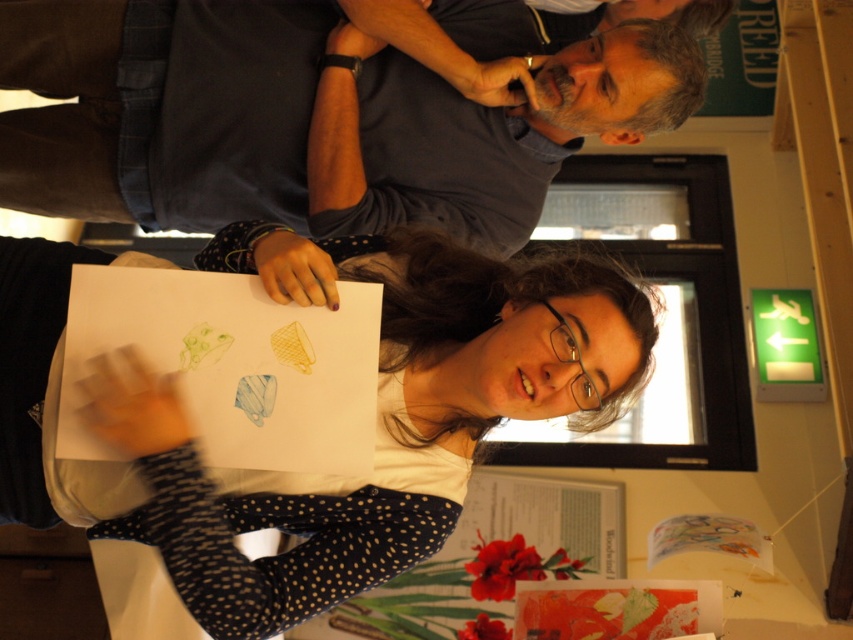
Is point (61, 52) farther from camera compared to point (840, 586)?

No, (61, 52) is in front of (840, 586).

Does dark blue shirt at upper center have a larger size compared to green illuminated sign at upper right?

No, dark blue shirt at upper center is not bigger than green illuminated sign at upper right.

Who is more distant from viewer, (10, 65) or (815, 173)?

Point (815, 173)

Locate an element on the screen. dark blue shirt at upper center is located at coordinates (305, 120).

Is point (578, 292) positioned before point (100, 182)?

Yes, it is.

How much distance is there between white paper at center and dark blue shirt at upper center?

The distance of white paper at center from dark blue shirt at upper center is 19.26 inches.

Which is behind, point (523, 349) or point (163, 92)?

Positioned behind is point (163, 92).

This screenshot has width=853, height=640. I want to click on white paper at center, so click(x=378, y=413).

Is white paper at center wider than green illuminated sign at upper right?

Yes.

From the picture: Does white paper at center appear under green illuminated sign at upper right?

Indeed, white paper at center is positioned under green illuminated sign at upper right.

Is point (331, 500) closer to viewer compared to point (843, 586)?

Yes, point (331, 500) is in front of point (843, 586).

Image resolution: width=853 pixels, height=640 pixels. I want to click on white paper at center, so click(x=378, y=413).